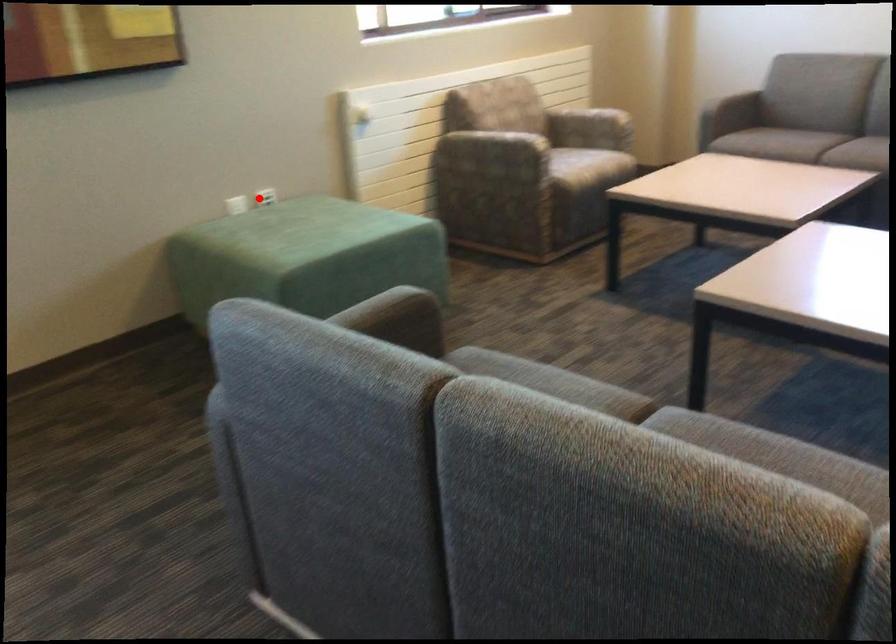
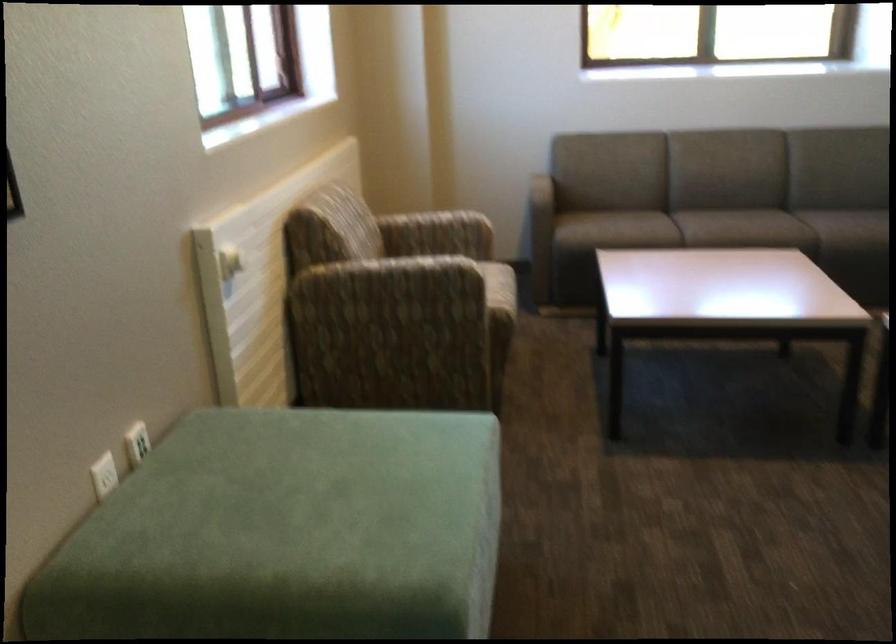
Where in the second image is the point corresponding to the highlighted location from the first image?

(136, 442)